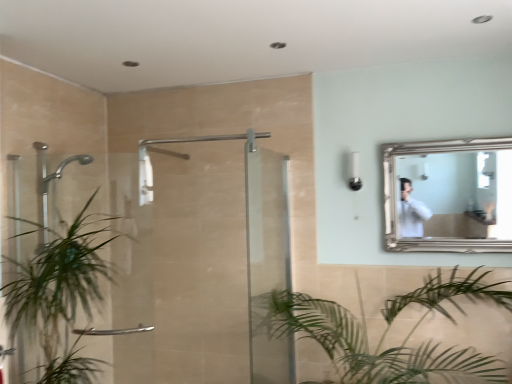
Question: Is white plastic light fixture at upper center oriented away from clear glass door at center, which is counted as the 2th screen door, starting from the left?

Choices:
 (A) no
 (B) yes

Answer: (A)

Question: From the image's perspective, does white plastic light fixture at upper center appear higher than clear glass door at center, placed as the 1th screen door when sorted from right to left?

Choices:
 (A) yes
 (B) no

Answer: (A)

Question: Is white plastic light fixture at upper center at the right side of clear glass door at center, placed as the 1th screen door when sorted from right to left?

Choices:
 (A) yes
 (B) no

Answer: (A)

Question: From a real-world perspective, is white plastic light fixture at upper center over clear glass door at center, placed as the 1th screen door when sorted from right to left?

Choices:
 (A) yes
 (B) no

Answer: (A)

Question: Considering the relative sizes of white plastic light fixture at upper center and clear glass door at center, which is counted as the 2th screen door, starting from the left, in the image provided, is white plastic light fixture at upper center bigger than clear glass door at center, which is counted as the 2th screen door, starting from the left,?

Choices:
 (A) no
 (B) yes

Answer: (A)

Question: Visually, is white plastic light fixture at upper center positioned to the left or to the right of clear glass shower door at left, placed as the 1th screen door when sorted from left to right?

Choices:
 (A) right
 (B) left

Answer: (A)

Question: Considering the positions of white plastic light fixture at upper center and clear glass shower door at left, acting as the 2th screen door starting from the right, in the image, is white plastic light fixture at upper center bigger or smaller than clear glass shower door at left, acting as the 2th screen door starting from the right,?

Choices:
 (A) big
 (B) small

Answer: (B)

Question: From a real-world perspective, is white plastic light fixture at upper center positioned above or below clear glass shower door at left, acting as the 2th screen door starting from the right?

Choices:
 (A) below
 (B) above

Answer: (B)

Question: In terms of height, does white plastic light fixture at upper center look taller or shorter compared to clear glass shower door at left, acting as the 2th screen door starting from the right?

Choices:
 (A) short
 (B) tall

Answer: (A)

Question: Relative to white plastic light fixture at upper center, is silver/golden frame mirror at upper right in front or behind?

Choices:
 (A) behind
 (B) front

Answer: (B)

Question: Is point (432, 195) positioned closer to the camera than point (350, 183)?

Choices:
 (A) farther
 (B) closer

Answer: (B)

Question: Is silver/golden frame mirror at upper right to the left or to the right of white plastic light fixture at upper center in the image?

Choices:
 (A) right
 (B) left

Answer: (A)

Question: From the image's perspective, is silver/golden frame mirror at upper right located above or below white plastic light fixture at upper center?

Choices:
 (A) above
 (B) below

Answer: (B)

Question: Do you think clear glass door at center, which is counted as the 2th screen door, starting from the left, is within clear glass shower door at left, acting as the 2th screen door starting from the right, or outside of it?

Choices:
 (A) inside
 (B) outside

Answer: (B)

Question: Considering their positions, is clear glass door at center, placed as the 1th screen door when sorted from right to left, located in front of or behind clear glass shower door at left, acting as the 2th screen door starting from the right?

Choices:
 (A) front
 (B) behind

Answer: (A)